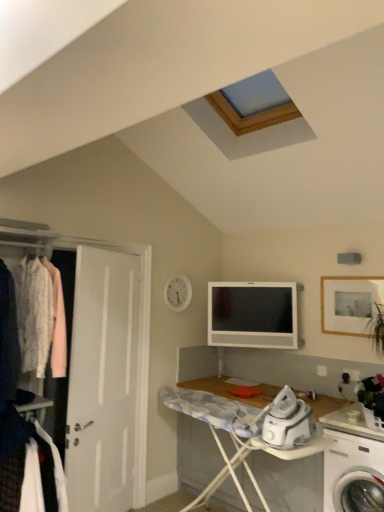
Question: Do you think white plastic washing machine at lower right is within satin silver television at center, or outside of it?

Choices:
 (A) outside
 (B) inside

Answer: (A)

Question: Is white plastic washing machine at lower right bigger or smaller than satin silver television at center?

Choices:
 (A) small
 (B) big

Answer: (B)

Question: Which of these objects is positioned farthest from the wooden ironing board at lower center?

Choices:
 (A) white plastic washing machine at lower right
 (B) white fabric at left
 (C) wooden framed photo at upper right
 (D) white matte door at left
 (E) satin silver television at center

Answer: (C)

Question: Which of these objects is positioned farthest from the white fabric clothes at left?

Choices:
 (A) wooden ironing board at lower center
 (B) wooden framed photo at upper right
 (C) white fabric at left
 (D) white matte door at left
 (E) satin silver television at center

Answer: (B)